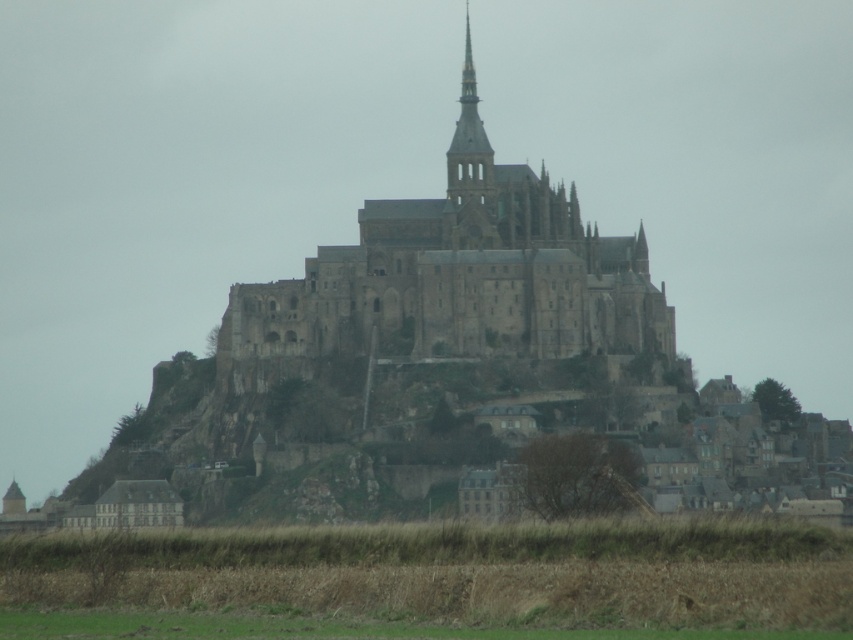
Is gray stone castle at center thinner than stone spire at upper center?

No.

Is gray stone castle at center above stone spire at upper center?

Incorrect, gray stone castle at center is not positioned above stone spire at upper center.

You are a GUI agent. You are given a task and a screenshot of the screen. Output one action in this format:
    pyautogui.click(x=<x>, y=<y>)
    Task: Click on the gray stone castle at center
    Image resolution: width=853 pixels, height=640 pixels.
    Given the screenshot: What is the action you would take?
    pyautogui.click(x=462, y=273)

Where is `gray stone castle at center`? This screenshot has height=640, width=853. gray stone castle at center is located at coordinates (462, 273).